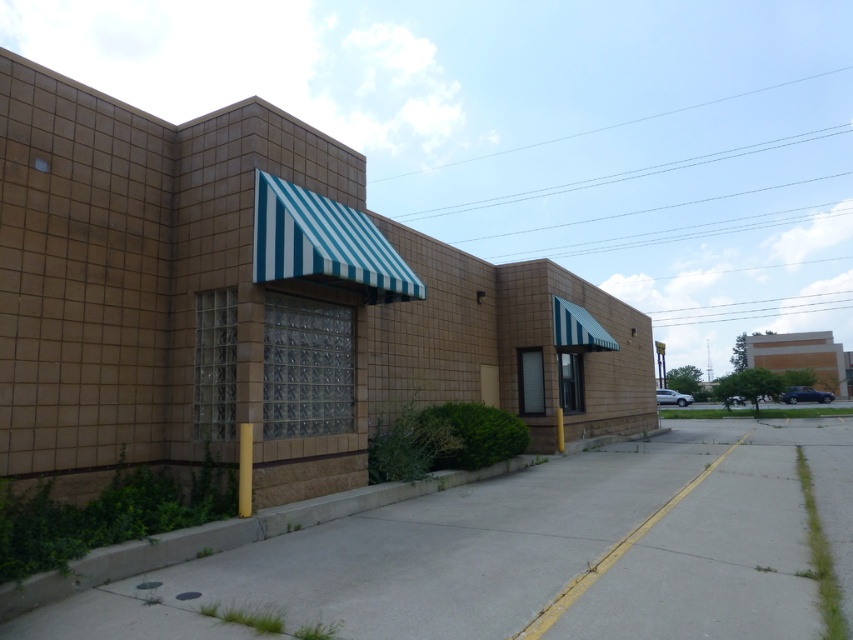
Question: Does brown tile building at center have a smaller size compared to gray concrete pavement at lower center?

Choices:
 (A) no
 (B) yes

Answer: (A)

Question: Which point is farther from the camera taking this photo?

Choices:
 (A) (744, 586)
 (B) (10, 168)

Answer: (B)

Question: Can you confirm if brown tile building at center is smaller than gray concrete pavement at lower center?

Choices:
 (A) yes
 (B) no

Answer: (B)

Question: Considering the relative positions of brown tile building at center and gray concrete pavement at lower center in the image provided, where is brown tile building at center located with respect to gray concrete pavement at lower center?

Choices:
 (A) below
 (B) above

Answer: (B)